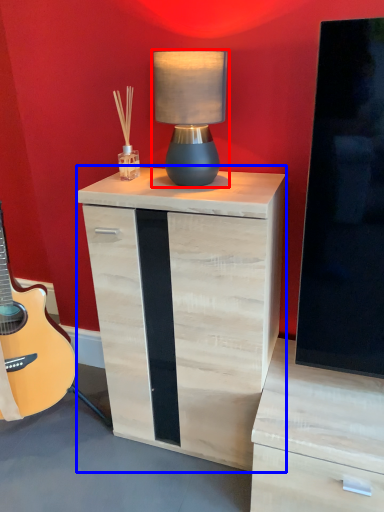
Question: Which point is further to the camera, table lamp (highlighted by a red box) or nightstand (highlighted by a blue box)?

Choices:
 (A) table lamp
 (B) nightstand

Answer: (B)